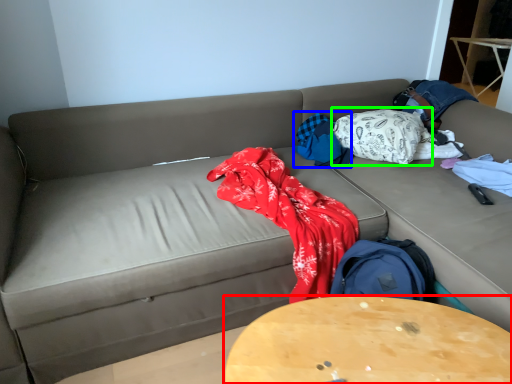
Question: Estimate the real-world distances between objects in this image. Which object is closer to table (highlighted by a red box), blanket (highlighted by a blue box) or blanket (highlighted by a green box)?

Choices:
 (A) blanket
 (B) blanket

Answer: (A)